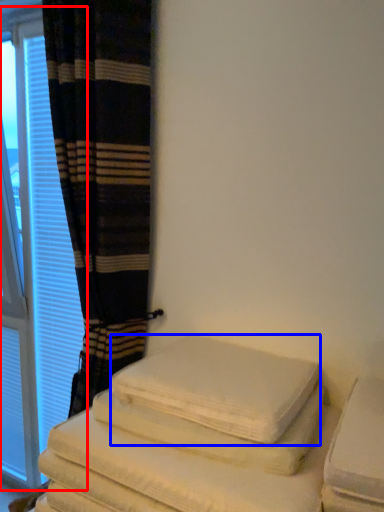
Question: Which of the following is the farthest to the observer, window (highlighted by a red box) or bath towel (highlighted by a blue box)?

Choices:
 (A) window
 (B) bath towel

Answer: (A)